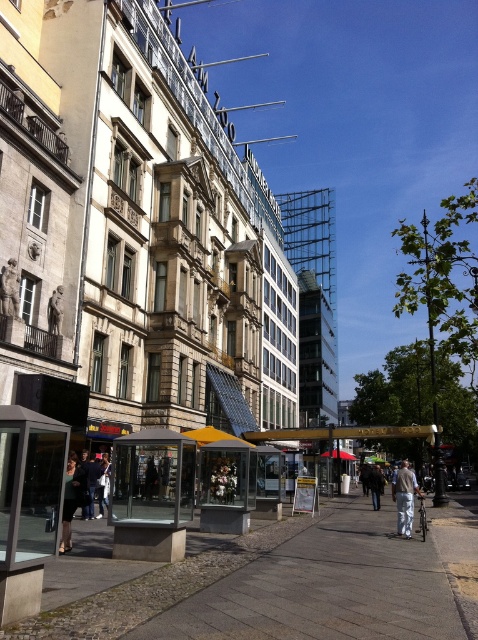
Question: Among these points, which one is nearest to the camera?

Choices:
 (A) (399, 486)
 (B) (65, 486)
 (C) (171, 492)
 (D) (370, 484)

Answer: (C)

Question: From the image, what is the correct spatial relationship of light beige pants at center in relation to dark gray fabric coat at lower left?

Choices:
 (A) above
 (B) below

Answer: (B)

Question: Is dark gray fabric coat at lower left bigger than brown leather jacket at center?

Choices:
 (A) yes
 (B) no

Answer: (B)

Question: Considering the real-world distances, which object is closest to the brown leather jacket at center?

Choices:
 (A) dark gray fabric coat at lower left
 (B) transparent glass bus stop at center
 (C) light beige pants at center

Answer: (C)

Question: Which point is closer to the camera?

Choices:
 (A) (125, 484)
 (B) (63, 541)
 (C) (369, 472)

Answer: (B)

Question: Is light beige pants at center above dark gray fabric coat at lower left?

Choices:
 (A) yes
 (B) no

Answer: (B)